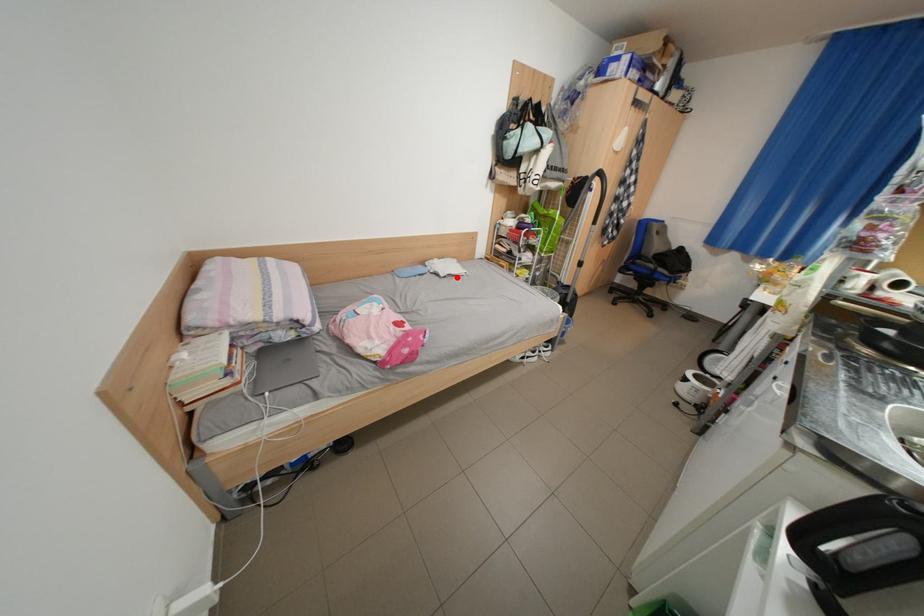
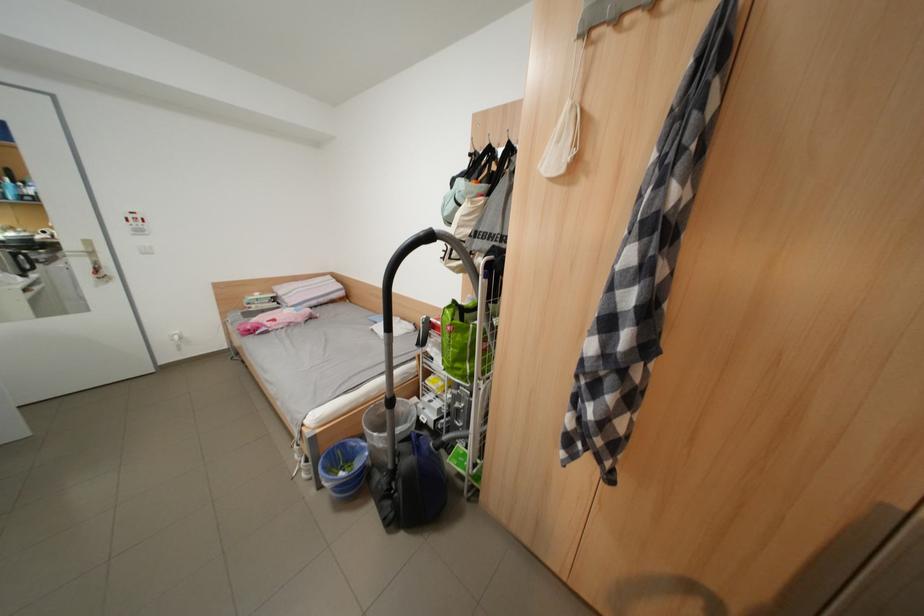
Find the pixel in the second image that matches the highlighted location in the first image.

(383, 331)